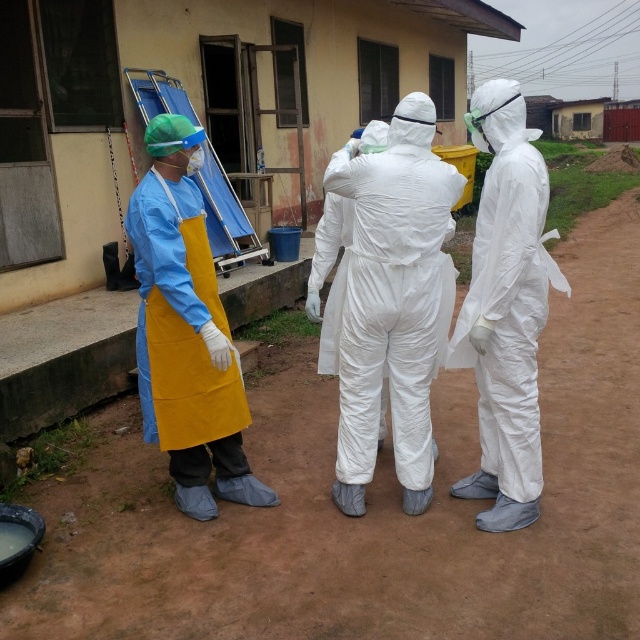
You are standing in the medical facility and need to determine which of the two points, point (202, 440) or point (518, 472), is closer to you. Based on the coordinates provided, which point is nearer?

Point (202, 440) is closer to you because it is further to the camera than point (518, 472).